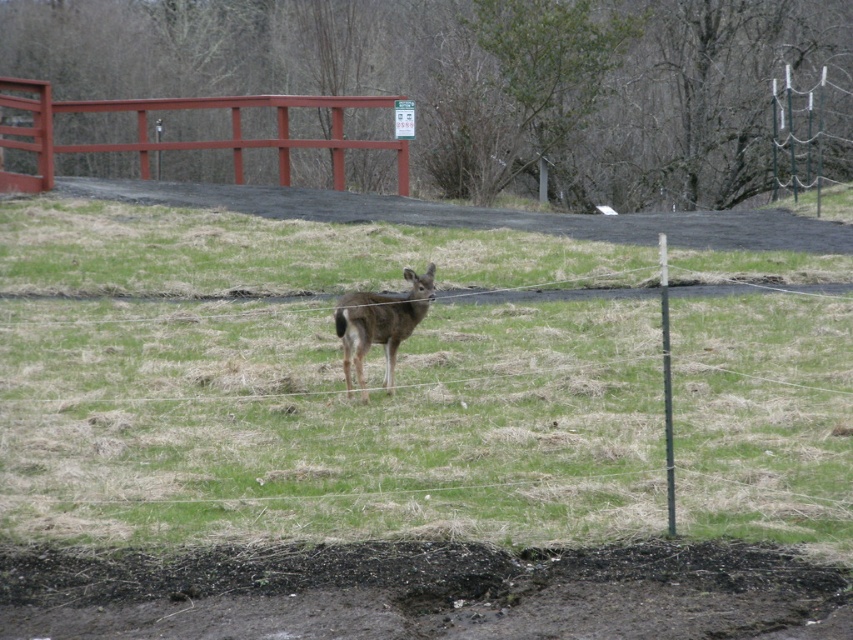
You are a painter setting up your easel to sketch the scene. You want to ensure that the smooth wooden fence at upper center and the brown matte deer at center are both visible in your composition. Based on their sizes, which object should you position closer to the center of your canvas to maintain balance?

The smooth wooden fence at upper center might be wider than brown matte deer at center, so positioning the fence closer to the center would help balance the composition due to its potentially larger size.

You are a hiker who has spotted a deer in the field. You want to approach the deer without getting too close to the wire fence in the foreground. Which direction should you move from your current position at point (317,385) to stay away from the fence?

The green grassy area at center is located at point (317,385), so moving towards the center would keep you away from the wire fence in the foreground.